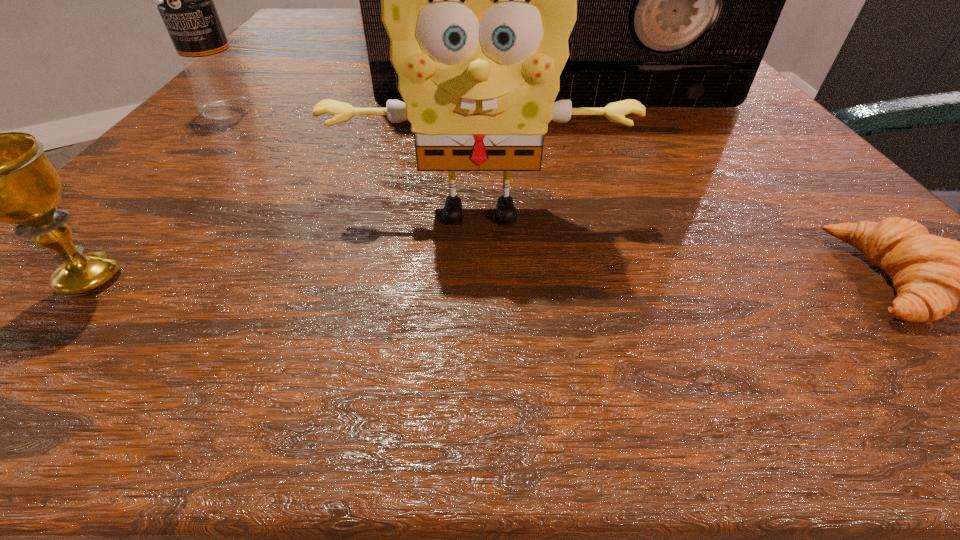
What are the coordinates of `videotape` in the screenshot? It's located at (677, 0).

Where is `vodka`? The height and width of the screenshot is (540, 960). vodka is located at coordinates (184, 0).

This screenshot has height=540, width=960. I want to click on sponge, so click(478, 0).

You are a GUI agent. You are given a task and a screenshot of the screen. Output one action in this format:
    pyautogui.click(x=<x>, y=<y>)
    Task: Click on the chalice
    
    Given the screenshot: What is the action you would take?
    pyautogui.click(x=0, y=177)

Identify the location of blank space located on the front side of the videotape. The image size is (960, 540). (567, 134).

Identify the location of blank space located 0.240m on the label of the vodka. (114, 233).

Locate an element on the screen. vacant area located on the face of the sponge is located at coordinates (479, 350).

Identify the location of vacant space located on the right of the chalice. The height and width of the screenshot is (540, 960). (319, 278).

I want to click on object located in the near edge section of the desktop, so click(x=0, y=177).

The width and height of the screenshot is (960, 540). What are the coordinates of `vodka present at the left edge` in the screenshot? It's located at (184, 0).